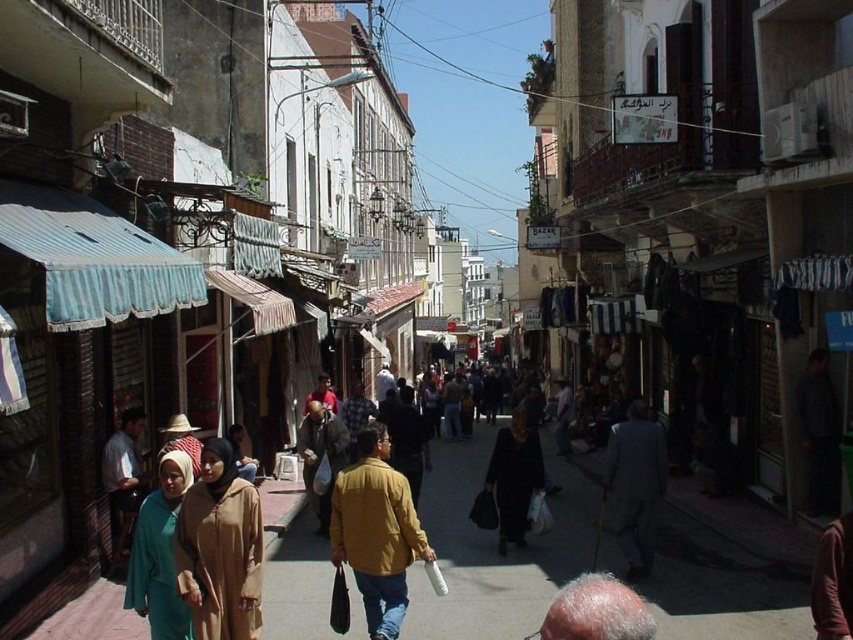
Based on the photo, does dark gray suit at center appear over black matte dress at center?

Yes, dark gray suit at center is above black matte dress at center.

Describe the element at coordinates (635, 484) in the screenshot. I see `dark gray suit at center` at that location.

Find the location of `dark gray suit at center`. dark gray suit at center is located at coordinates (635, 484).

Between point (218, 502) and point (163, 513), which one is positioned in front?

Point (218, 502) is more forward.

Is point (242, 580) farther from viewer compared to point (166, 593)?

Yes.

The height and width of the screenshot is (640, 853). What do you see at coordinates (219, 548) in the screenshot?
I see `matte beige abaya at center` at bounding box center [219, 548].

The image size is (853, 640). Find the location of `matte beige abaya at center`. matte beige abaya at center is located at coordinates (219, 548).

Is teal fabric hijab at center further to the viewer compared to yellow matte jacket at center?

No.

Is teal fabric hijab at center shorter than yellow matte jacket at center?

Yes.

Where is `teal fabric hijab at center`? The width and height of the screenshot is (853, 640). teal fabric hijab at center is located at coordinates (160, 552).